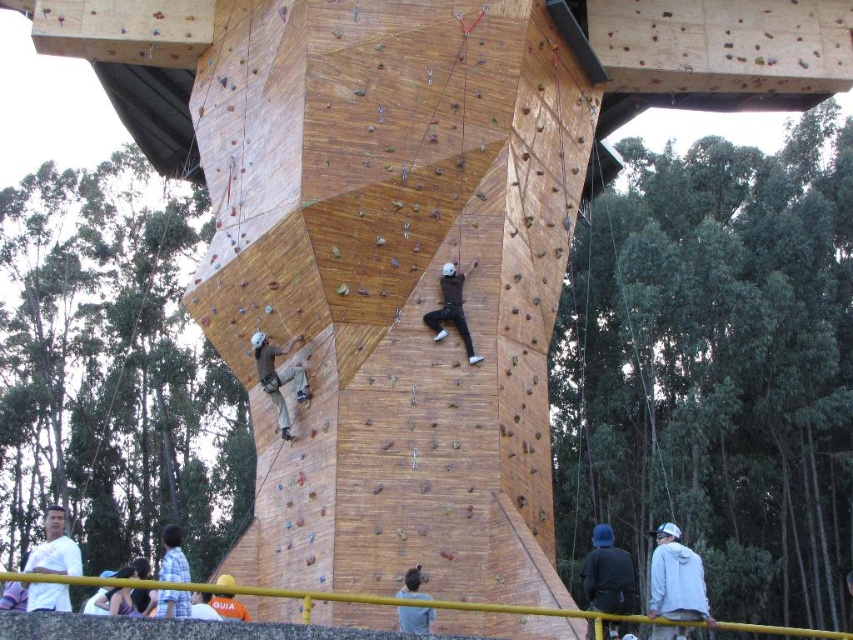
Can you confirm if dark blue jacket at center is positioned above dark gray fabric shirt at lower center?

No, dark blue jacket at center is not above dark gray fabric shirt at lower center.

I want to click on dark blue jacket at center, so click(x=608, y=573).

Is point (625, 627) farther from viewer compared to point (405, 572)?

No.

Where is `dark blue jacket at center`? The height and width of the screenshot is (640, 853). dark blue jacket at center is located at coordinates pyautogui.click(x=608, y=573).

Is white matte shirt at lower left closer to camera compared to matte brown pants at center?

Yes, it is in front of matte brown pants at center.

In order to click on white matte shirt at lower left in this screenshot , I will do `click(54, 548)`.

Between point (45, 570) and point (271, 349), which one is positioned in front?

Positioned in front is point (45, 570).

I want to click on white matte shirt at lower left, so click(54, 548).

Does white matte jacket at lower right come behind dark gray fabric shirt at lower center?

That is False.

Does point (706, 614) lie in front of point (421, 577)?

Yes, point (706, 614) is in front of point (421, 577).

The height and width of the screenshot is (640, 853). Identify the location of white matte jacket at lower right. (676, 579).